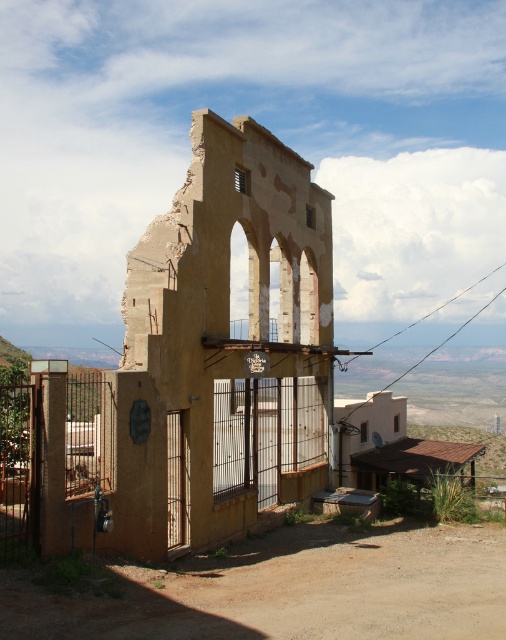
You are an archaeologist standing in front of the yellow stucco ruins at center and the brown wooden gate at left. You need to determine which structure is wider. Which one has a greater width?

The yellow stucco ruins at center has a greater width than the brown wooden gate at left.

You are standing in front of the desert ruins and see the rusty metal gate at lower left and the brown wooden gate at left. Which gate is positioned lower in the scene?

The rusty metal gate at lower left is positioned lower than the brown wooden gate at left.

You are a delivery person trying to enter the site through the gates. The rusty metal gate at lower left and the brown wooden gate at left are both closed. Which gate should you choose to pass through if you have a vehicle that is 3 meters wide?

The rusty metal gate at lower left has a larger width than the brown wooden gate at left. Since your vehicle is 3 meters wide, you should choose the rusty metal gate at lower left as it can accommodate the vehicle width.